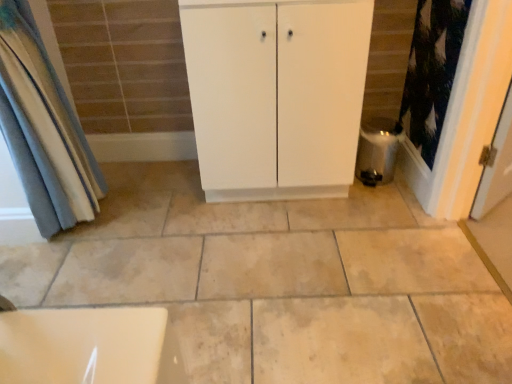
Where is `free location to the right of blue fabric curtain at left`? free location to the right of blue fabric curtain at left is located at coordinates (145, 221).